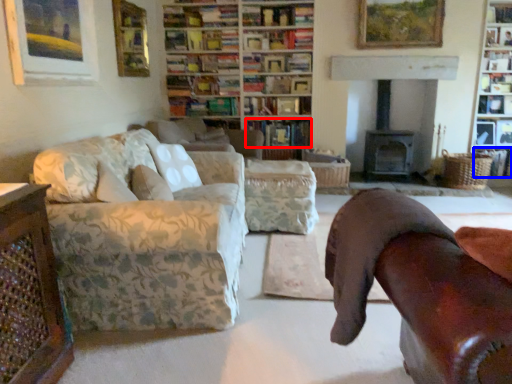
Question: Which object appears farthest to the camera in this image, book (highlighted by a red box) or book (highlighted by a blue box)?

Choices:
 (A) book
 (B) book

Answer: (A)